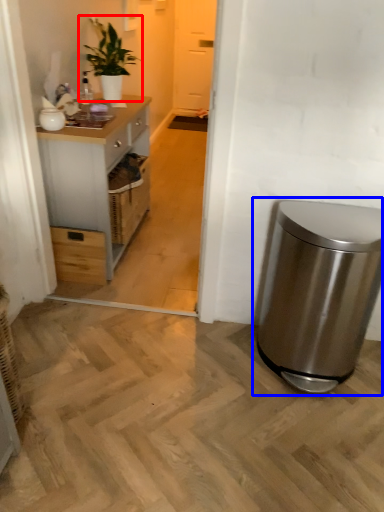
Question: Among these objects, which one is nearest to the camera, houseplant (highlighted by a red box) or waste container (highlighted by a blue box)?

Choices:
 (A) houseplant
 (B) waste container

Answer: (B)